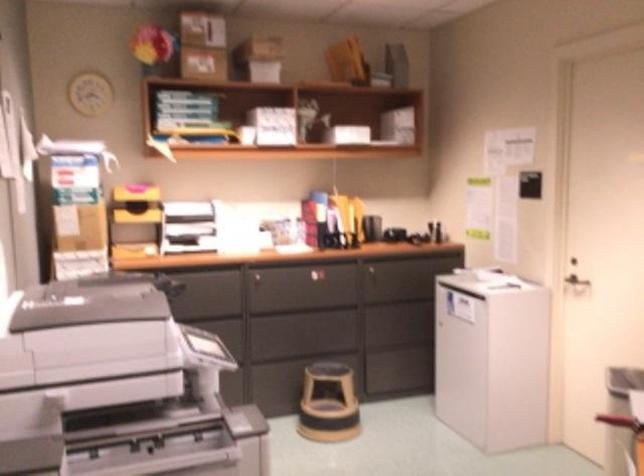
Find where to pull the silver door handle. Please return your answer as a coordinate pair (x, y).

(578, 284)